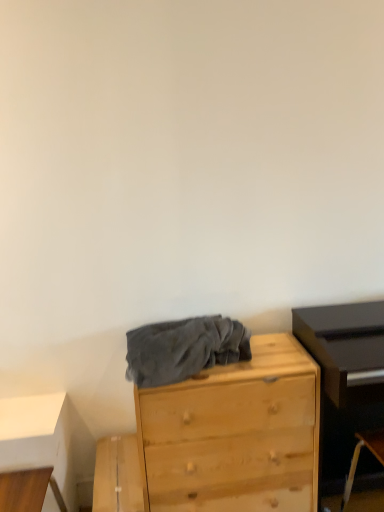
Question: From the image's perspective, is light wood chest of drawers at center beneath wooden table at lower left?

Choices:
 (A) yes
 (B) no

Answer: (B)

Question: From the image's perspective, is light wood chest of drawers at center above wooden table at lower left?

Choices:
 (A) no
 (B) yes

Answer: (B)

Question: Is light wood chest of drawers at center looking in the opposite direction of wooden table at lower left?

Choices:
 (A) yes
 (B) no

Answer: (B)

Question: Is the position of light wood chest of drawers at center less distant than that of wooden table at lower left?

Choices:
 (A) yes
 (B) no

Answer: (A)

Question: Can you confirm if light wood chest of drawers at center is thinner than wooden table at lower left?

Choices:
 (A) yes
 (B) no

Answer: (B)

Question: Is light wood chest of drawers at center to the right of wooden table at lower left from the viewer's perspective?

Choices:
 (A) yes
 (B) no

Answer: (A)

Question: Is wooden table at lower left placed right next to gray fleece blanket at center?

Choices:
 (A) no
 (B) yes

Answer: (A)

Question: Considering the relative positions of wooden table at lower left and gray fleece blanket at center in the image provided, is wooden table at lower left to the right of gray fleece blanket at center from the viewer's perspective?

Choices:
 (A) no
 (B) yes

Answer: (A)

Question: From the image's perspective, does wooden table at lower left appear lower than gray fleece blanket at center?

Choices:
 (A) no
 (B) yes

Answer: (B)

Question: Can you confirm if wooden table at lower left is smaller than gray fleece blanket at center?

Choices:
 (A) yes
 (B) no

Answer: (B)

Question: Are wooden table at lower left and gray fleece blanket at center located far from each other?

Choices:
 (A) yes
 (B) no

Answer: (B)

Question: Considering the relative sizes of wooden table at lower left and gray fleece blanket at center in the image provided, is wooden table at lower left bigger than gray fleece blanket at center?

Choices:
 (A) yes
 (B) no

Answer: (A)

Question: Is gray fleece blanket at center far away from light wood chest of drawers at center?

Choices:
 (A) no
 (B) yes

Answer: (A)